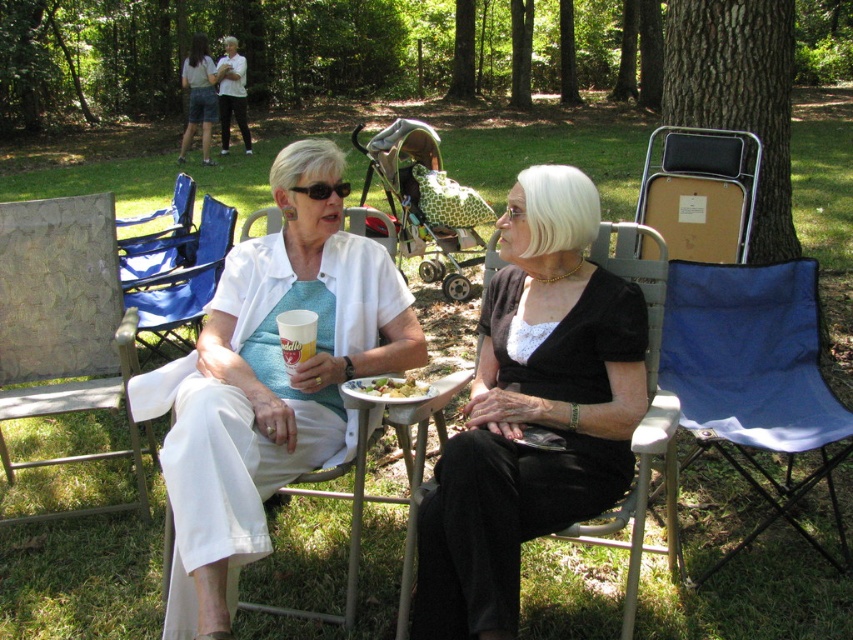
Question: Estimate the real-world distances between objects in this image. Which object is farther from the green matte salad at lower center?

Choices:
 (A) blue fabric chair at right
 (B) white matte shirt at center
 (C) black satin dress at center
 (D) black plastic sunglasses at upper center

Answer: (A)

Question: Can you confirm if white matte shirt at center is wider than blue fabric chair at left?

Choices:
 (A) yes
 (B) no

Answer: (B)

Question: Can you confirm if white matte shirt at center is wider than brown cardboard chair at center right?

Choices:
 (A) yes
 (B) no

Answer: (A)

Question: Among these points, which one is nearest to the camera?

Choices:
 (A) (550, 307)
 (B) (683, 360)
 (C) (386, 390)
 (D) (691, 168)

Answer: (C)

Question: Among these objects, which one is nearest to the camera?

Choices:
 (A) blue fabric chair at right
 (B) black satin dress at center
 (C) black plastic sunglasses at upper center

Answer: (B)

Question: Can you confirm if black satin dress at center is wider than black plastic sunglasses at upper center?

Choices:
 (A) no
 (B) yes

Answer: (B)